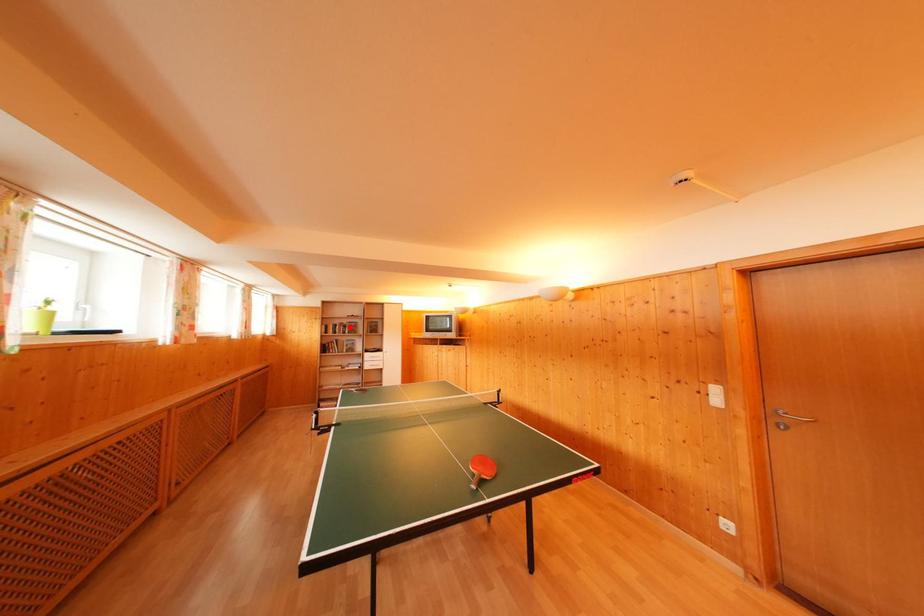
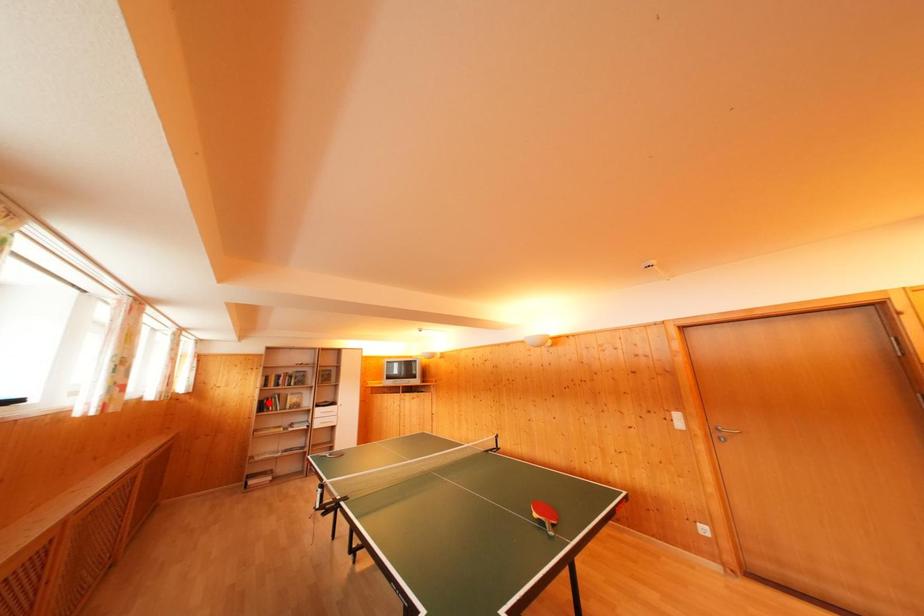
I am providing you with two images of the same scene from different viewpoints. A red point is marked on the first image and another point is marked on the second image. Is the marked point in image1 the same physical position as the marked point in image2?

No